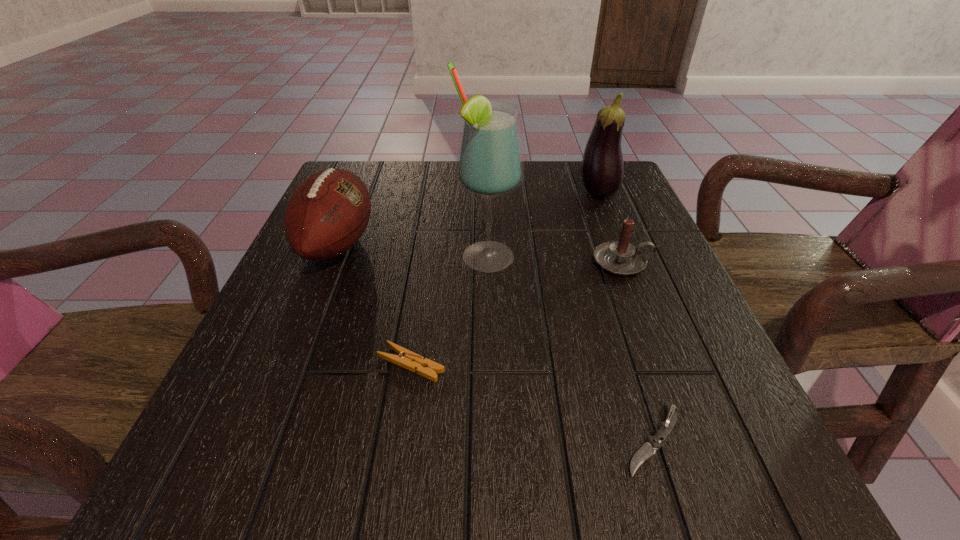
Where is `the nearest object`? The height and width of the screenshot is (540, 960). the nearest object is located at coordinates (648, 449).

Locate an element on the screen. The width and height of the screenshot is (960, 540). vacant point located on the left of the tallest object is located at coordinates (413, 258).

Locate an element on the screen. This screenshot has width=960, height=540. free region located on the front of the fifth shortest object is located at coordinates (616, 240).

This screenshot has width=960, height=540. In order to click on free space located on the back of the leftmost object in this screenshot , I will do [364, 179].

Image resolution: width=960 pixels, height=540 pixels. I want to click on free space located on the back of the fifth tallest object, so click(431, 226).

Where is `vacant area situated on the left of the shortest object`? vacant area situated on the left of the shortest object is located at coordinates (458, 439).

This screenshot has width=960, height=540. What are the coordinates of `object positioned at the far edge` in the screenshot? It's located at (602, 170).

Locate an element on the screen. object present at the near edge is located at coordinates point(648,449).

I want to click on object that is at the left edge, so click(x=327, y=213).

This screenshot has height=540, width=960. I want to click on eggplant situated at the right edge, so click(602, 170).